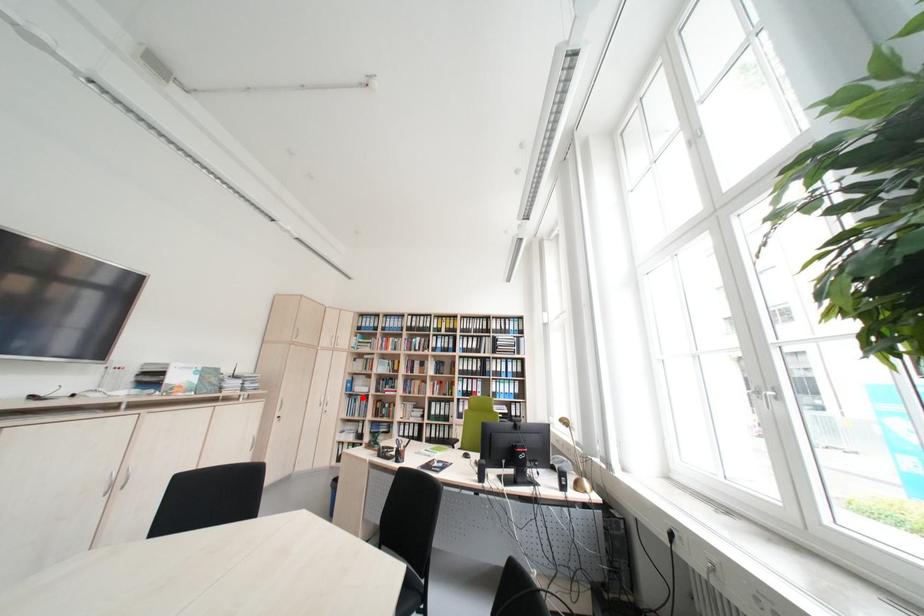
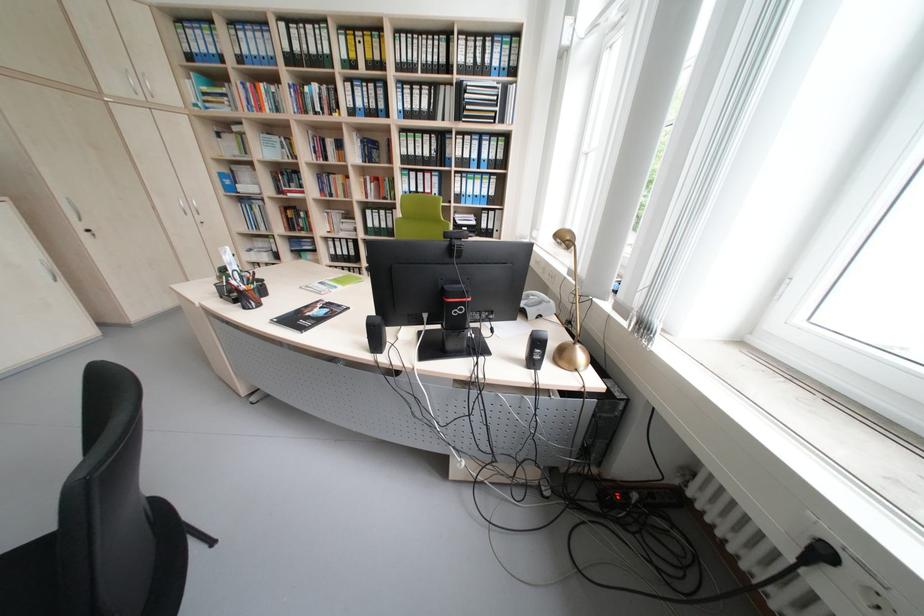
Question: I am providing you with two images of the same scene from different viewpoints. In image1, a red point is highlighted. Considering the same 3D point in image2, which of the following is correct?

Choices:
 (A) It is closer
 (B) It is farther

Answer: (A)